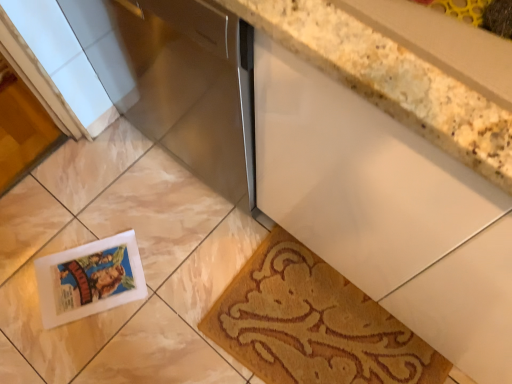
You are a GUI agent. You are given a task and a screenshot of the screen. Output one action in this format:
    pyautogui.click(x=<x>, y=<y>)
    Task: Click on the vacant location below white glossy postcard at lower left (from a real-world perspective)
    The image size is (512, 384).
    Given the screenshot: What is the action you would take?
    pyautogui.click(x=92, y=270)